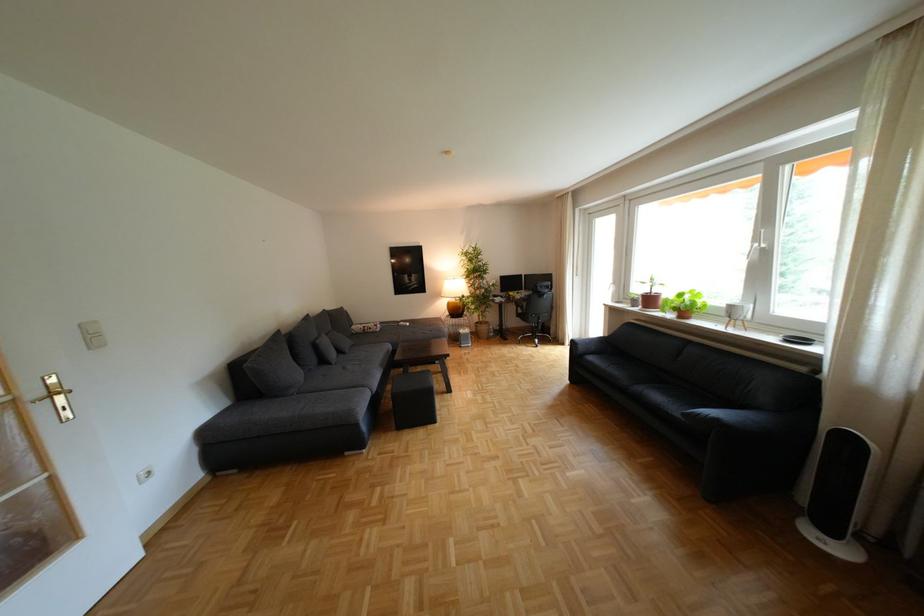
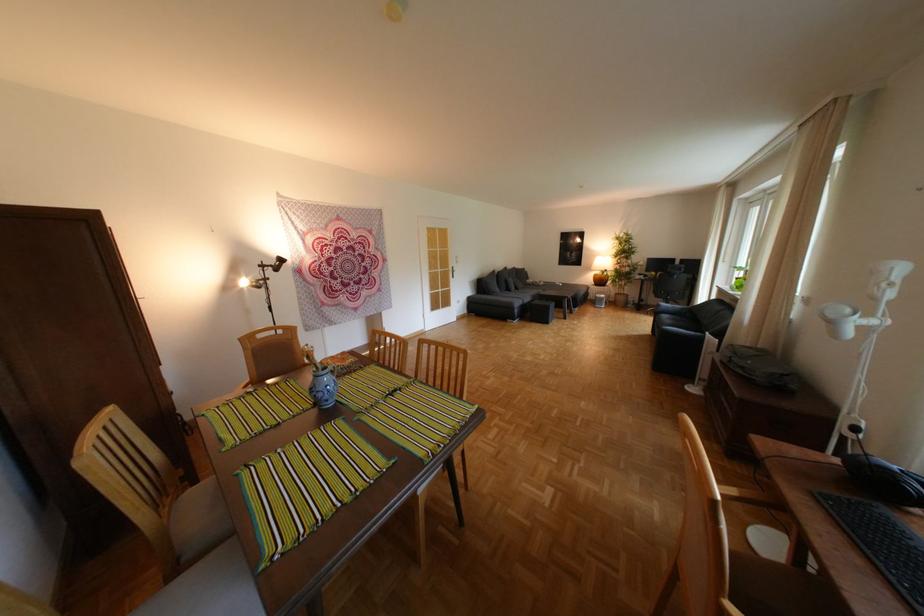
The point at (377, 427) is marked in the first image. Where is the corresponding point in the second image?

(529, 312)